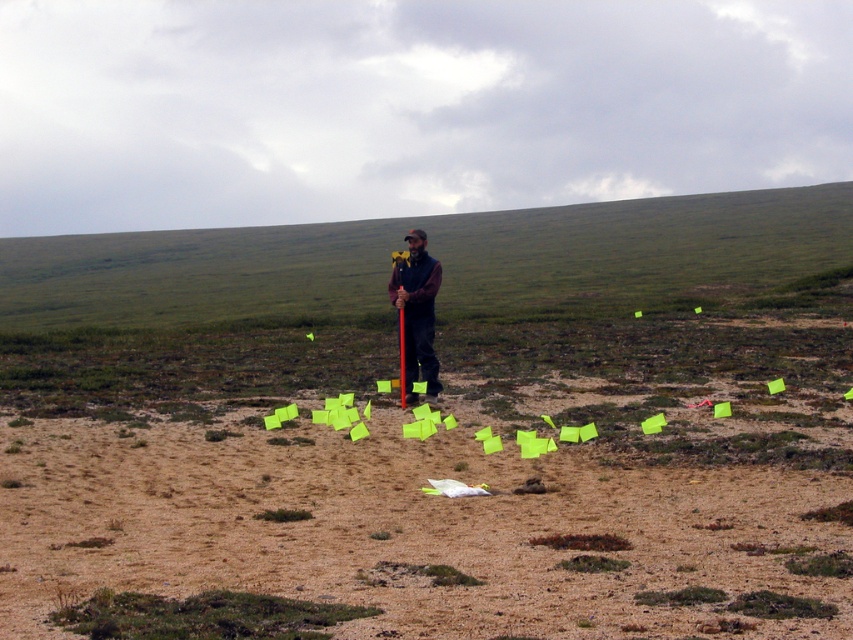
In the scene shown: You are standing at the center of the open landscape and want to place a new marker between the two points labeled point (370,442) and point (410,317). Which point should you move towards to ensure the new marker is closer to the viewer?

You should move towards point (370,442) because it is closer to the viewer than point (410,317).

You are a hiker who needs to take a photo of the dark blue fabric jacket at center. Your camera is 54.14 feet away from the jacket. Can you reach the camera to take the photo if you can move 60 feet in one go?

Result: The dark blue fabric jacket at center and camera are 54.14 feet apart from each other. Since you can move 60 feet in one go, you can reach the camera to take the photo.